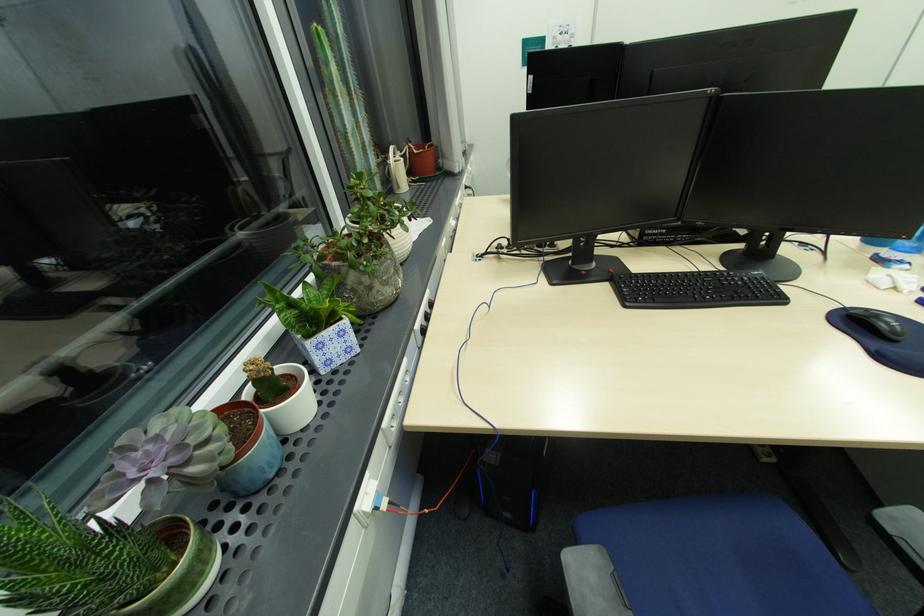
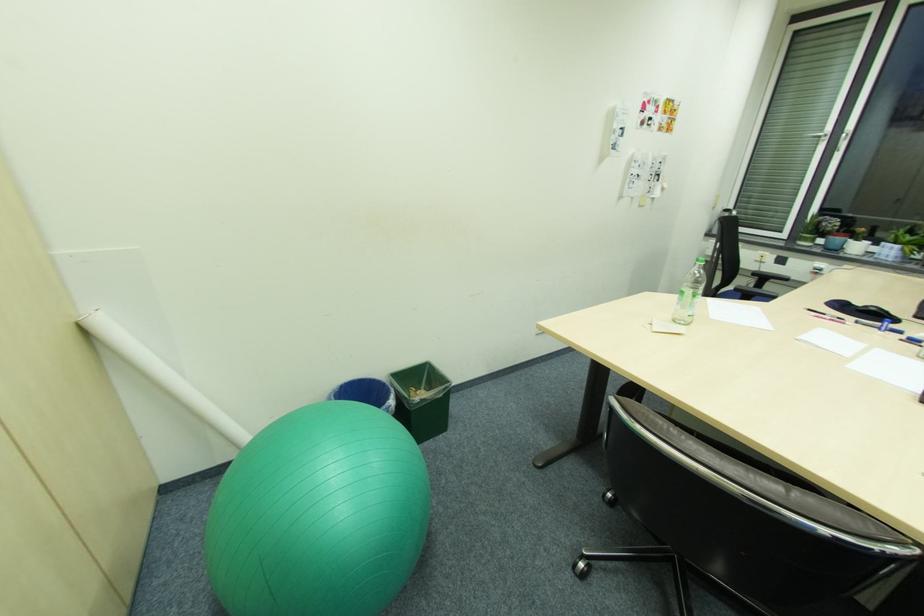
Where in the second image is the point corresponding to point (350, 323) from the first image?

(903, 246)